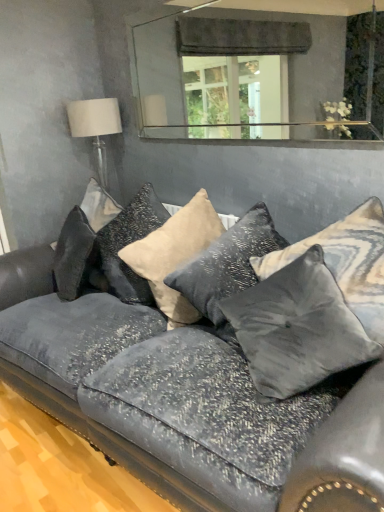
Question: From a real-world perspective, relative to satin beige pillow at center, arranged as the second pillow when viewed from the left, is satin gray pillow at center, the 3th pillow when ordered from left to right, vertically above or below?

Choices:
 (A) above
 (B) below

Answer: (B)

Question: Looking at their shapes, would you say satin gray pillow at center, which is counted as the 3th pillow, starting from the right, is wider or thinner than satin beige pillow at center, the 4th pillow in the right-to-left sequence?

Choices:
 (A) wide
 (B) thin

Answer: (A)

Question: Estimate the real-world distances between objects in this image. Which object is farther from the satin gray pillow at center, which is the fifth pillow in left-to-right order?

Choices:
 (A) satin gray pillow at center, which is counted as the 3th pillow, starting from the right
 (B) velvet gray pillow at center, arranged as the 2th pillow when viewed from the right
 (C) clear glass mirror at upper center
 (D) satin beige pillow at center, the 4th pillow in the right-to-left sequence
 (E) velvet couch at center

Answer: (C)

Question: Estimate the real-world distances between objects in this image. Which object is closer to the satin beige pillow at center, arranged as the second pillow when viewed from the left?

Choices:
 (A) velvet couch at center
 (B) white fabric lampshade at upper left
 (C) clear glass mirror at upper center
 (D) velvet gray pillow at center, arranged as the 2th pillow when viewed from the right
 (E) satin gray pillow at center, which is counted as the 3th pillow, starting from the right

Answer: (E)